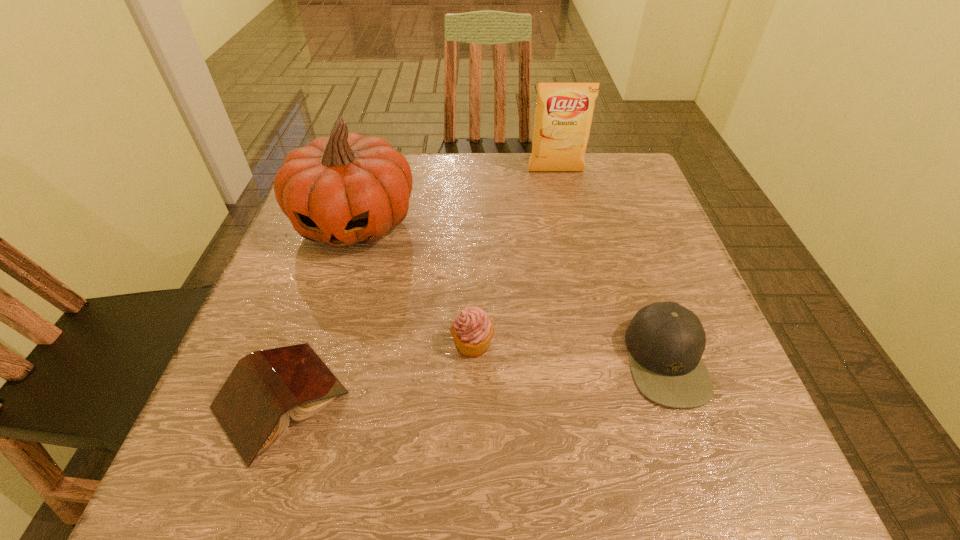
The image size is (960, 540). What are the coordinates of `free space that is in between the fourth nearest object and the third object from left to right` in the screenshot? It's located at (414, 282).

Locate an element on the screen. The image size is (960, 540). free space between the book and the third object from left to right is located at coordinates (376, 372).

Locate an element on the screen. The height and width of the screenshot is (540, 960). vacant point located between the cap and the crisp (potato chip) is located at coordinates (611, 266).

What are the coordinates of `free space between the farthest object and the book` in the screenshot? It's located at (419, 286).

The image size is (960, 540). I want to click on empty location between the shortest object and the cupcake, so click(x=376, y=372).

This screenshot has width=960, height=540. In order to click on free point between the fourth nearest object and the crisp (potato chip) in this screenshot , I will do `click(456, 197)`.

At what (x,y) coordinates should I click in order to perform the action: click on vacant area that lies between the cupcake and the book. Please return your answer as a coordinate pair (x, y). Image resolution: width=960 pixels, height=540 pixels. Looking at the image, I should click on (376, 372).

Identify which object is the second nearest to the cap. Please provide its 2D coordinates. Your answer should be formatted as a tuple, i.e. [(x, y)], where the tuple contains the x and y coordinates of a point satisfying the conditions above.

[(346, 189)]

This screenshot has height=540, width=960. I want to click on object that is the second closest to the cap, so click(346, 189).

Locate an element on the screen. Image resolution: width=960 pixels, height=540 pixels. blank space that satisfies the following two spatial constraints: 1. on the face of the pumpkin; 2. on the right side of the third object from right to left is located at coordinates (318, 343).